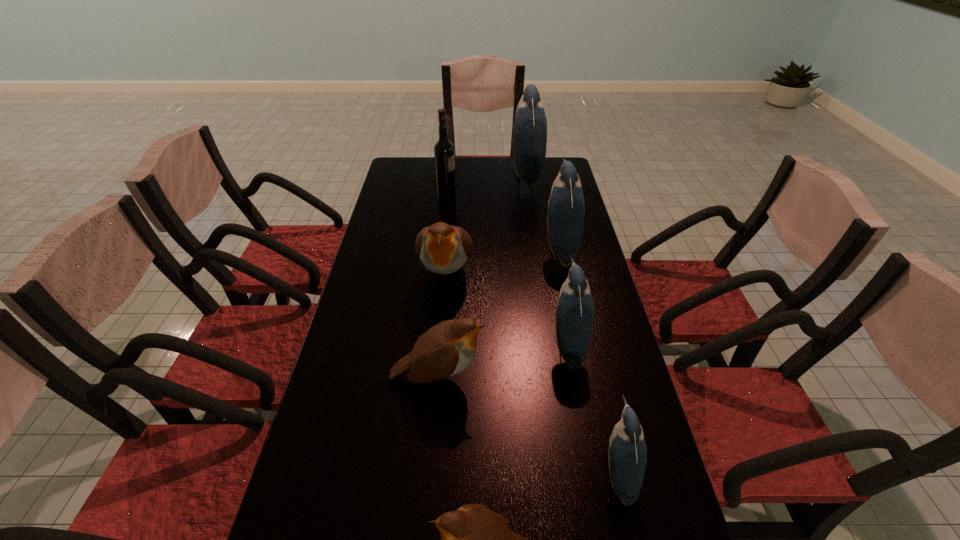
Where is `the tallest bird`? The image size is (960, 540). the tallest bird is located at coordinates (530, 126).

Locate an element on the screen. This screenshot has width=960, height=540. the farthest bird is located at coordinates (530, 126).

This screenshot has height=540, width=960. What are the coordinates of `wine bottle` in the screenshot? It's located at (444, 157).

This screenshot has height=540, width=960. Identify the location of the second farthest blue bird. (566, 207).

You are a GUI agent. You are given a task and a screenshot of the screen. Output one action in this format:
    pyautogui.click(x=<x>, y=<y>)
    Task: Click on the second biggest blue bird
    The image size is (960, 540).
    Given the screenshot: What is the action you would take?
    pyautogui.click(x=566, y=207)

Find the location of `the biggest brown bird`. the biggest brown bird is located at coordinates (443, 249).

You are a GUI agent. You are given a task and a screenshot of the screen. Output one action in this format:
    pyautogui.click(x=<x>, y=<y>)
    Task: Click on the third farthest blue bird
    The image size is (960, 540).
    Given the screenshot: What is the action you would take?
    pyautogui.click(x=574, y=309)

Find the location of a particular element. the second smallest brown bird is located at coordinates (446, 349).

What are the coordinates of `the second nearest object` in the screenshot? It's located at (627, 456).

The image size is (960, 540). In order to click on the smallest blue bird in this screenshot , I will do `click(627, 456)`.